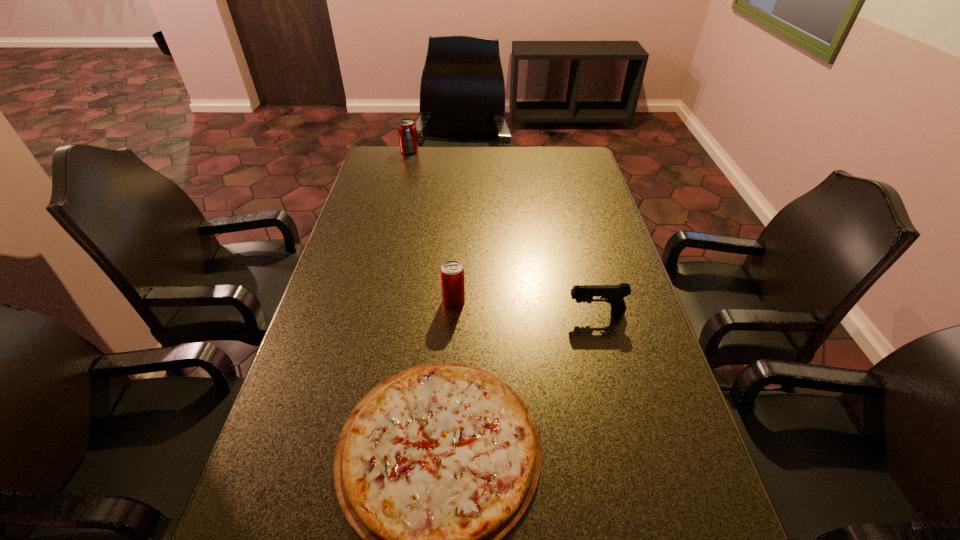
Where is `object at the left edge`? This screenshot has width=960, height=540. object at the left edge is located at coordinates (407, 131).

Where is `object present at the right edge`? The width and height of the screenshot is (960, 540). object present at the right edge is located at coordinates (614, 294).

You are a GUI agent. You are given a task and a screenshot of the screen. Output one action in this format:
    pyautogui.click(x=<x>, y=<y>)
    Task: Click on the object that is at the far left corner
    
    Given the screenshot: What is the action you would take?
    pyautogui.click(x=407, y=131)

At what (x,y) coordinates should I click in order to perform the action: click on vacant space at the far edge. Please return your answer as a coordinate pair (x, y). The height and width of the screenshot is (540, 960). Looking at the image, I should click on (516, 164).

At what (x,y) coordinates should I click in order to perform the action: click on free space at the left edge of the desktop. Please return your answer as a coordinate pair (x, y). Image resolution: width=960 pixels, height=540 pixels. Looking at the image, I should click on (324, 407).

I want to click on vacant space at the right edge, so click(x=630, y=441).

In order to click on free location at the far left corner in this screenshot , I will do `click(374, 163)`.

At what (x,y) coordinates should I click in order to perform the action: click on blank space at the far right corner of the desktop. Please return your answer as a coordinate pair (x, y). Looking at the image, I should click on (582, 148).

You are a GUI agent. You are given a task and a screenshot of the screen. Output one action in this format:
    pyautogui.click(x=<x>, y=<y>)
    Task: Click on the free point between the farthest object and the can
    
    Given the screenshot: What is the action you would take?
    pyautogui.click(x=432, y=226)

Locate an element on the screen. unoccupied position between the rightmost object and the can is located at coordinates (525, 307).